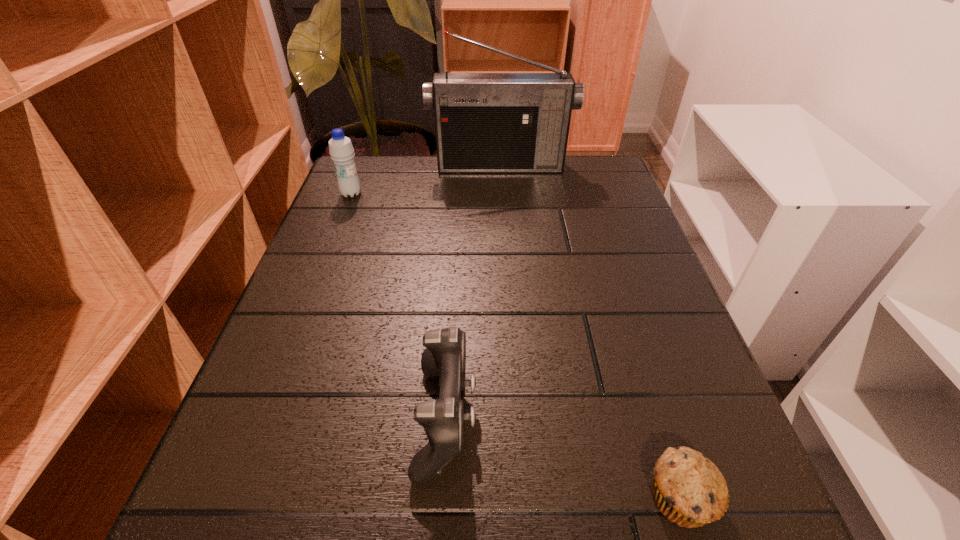
The height and width of the screenshot is (540, 960). I want to click on vacant area that lies between the tallest object and the shortest object, so click(x=590, y=332).

Identify the location of empty space that is in between the second farthest object and the radio receiver. The width and height of the screenshot is (960, 540). (425, 180).

Find the location of a particular element. The image size is (960, 540). vacant area that lies between the radio receiver and the leftmost object is located at coordinates (425, 180).

The image size is (960, 540). Find the location of `vacant space that's between the water bottle and the control`. vacant space that's between the water bottle and the control is located at coordinates (398, 306).

This screenshot has width=960, height=540. Find the location of `unoccupied position between the second tallest object and the muffin`. unoccupied position between the second tallest object and the muffin is located at coordinates (516, 346).

Find the location of a particular element. The width and height of the screenshot is (960, 540). vacant area between the farthest object and the second tallest object is located at coordinates (425, 180).

Image resolution: width=960 pixels, height=540 pixels. In order to click on object identified as the second closest to the shortest object in this screenshot , I will do `click(484, 122)`.

You are a GUI agent. You are given a task and a screenshot of the screen. Output one action in this format:
    pyautogui.click(x=<x>, y=<y>)
    Task: Click on the object that is the third closest to the second tallest object
    This screenshot has height=540, width=960.
    Given the screenshot: What is the action you would take?
    pyautogui.click(x=689, y=490)

The image size is (960, 540). Identify the location of vacant area that satisfies the following two spatial constraints: 1. on the front-facing side of the radio receiver; 2. on the surface of the second shortest object with buttons. (517, 418).

You are a GUI agent. You are given a task and a screenshot of the screen. Output one action in this format:
    pyautogui.click(x=<x>, y=<y>)
    Task: Click on the blank space that satisfies the following two spatial constraints: 1. on the front-facing side of the radio receiver; 2. on the surface of the control with buttons
    The width and height of the screenshot is (960, 540).
    Given the screenshot: What is the action you would take?
    pyautogui.click(x=517, y=418)